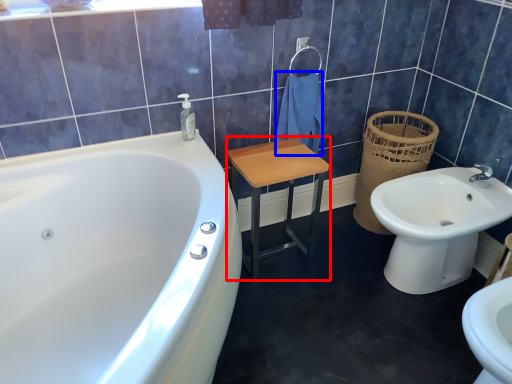
Question: Which of the following is the closest to the observer, step stool (highlighted by a red box) or bath towel (highlighted by a blue box)?

Choices:
 (A) step stool
 (B) bath towel

Answer: (A)